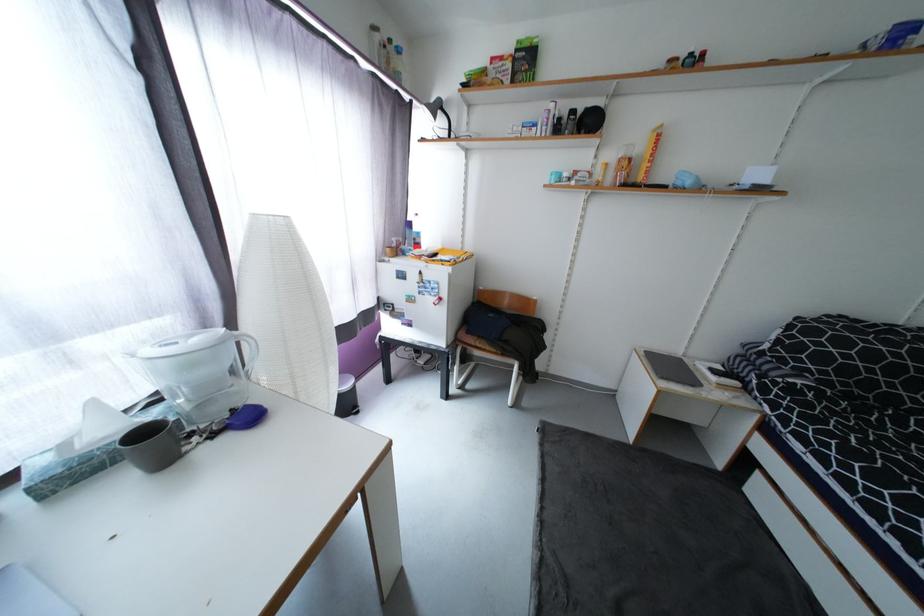
Where is `dark grey mug`? The image size is (924, 616). dark grey mug is located at coordinates (152, 445).